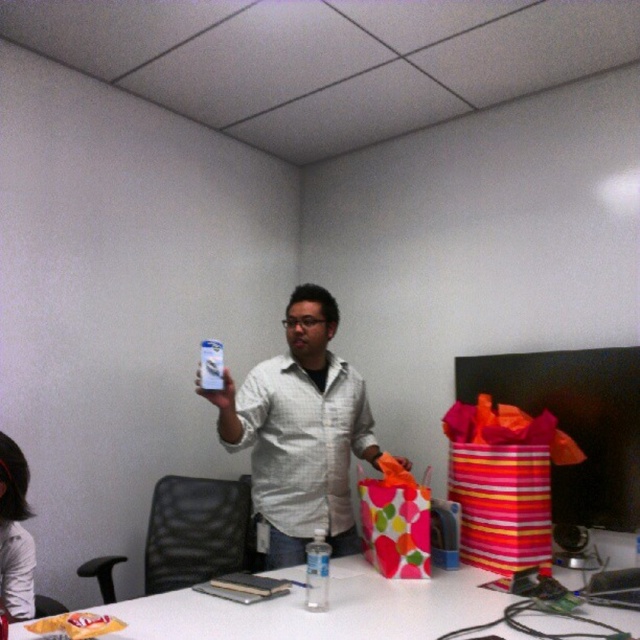
You are standing in the room and want to place a small object on the nearest surface. Which object between the white glossy table at center and the matte plastic bottle at upper center should you choose?

You should choose the white glossy table at center because it is closer to you than the matte plastic bottle at upper center.

You are an office assistant who needs to place a new white glossy can at center on the white glossy table at center. Based on the current arrangement, is the can already on the table?

The white glossy can at center is located above the white glossy table at center, so it is already placed on the table.

You are standing in the office and need to place the matte plastic bottle at upper center onto the white glossy table at center. Based on their positions, can you directly place the bottle onto the table without moving either object?

The white glossy table at center is below the matte plastic bottle at upper center, so yes, you can directly place the bottle onto the table since it is positioned above the table.